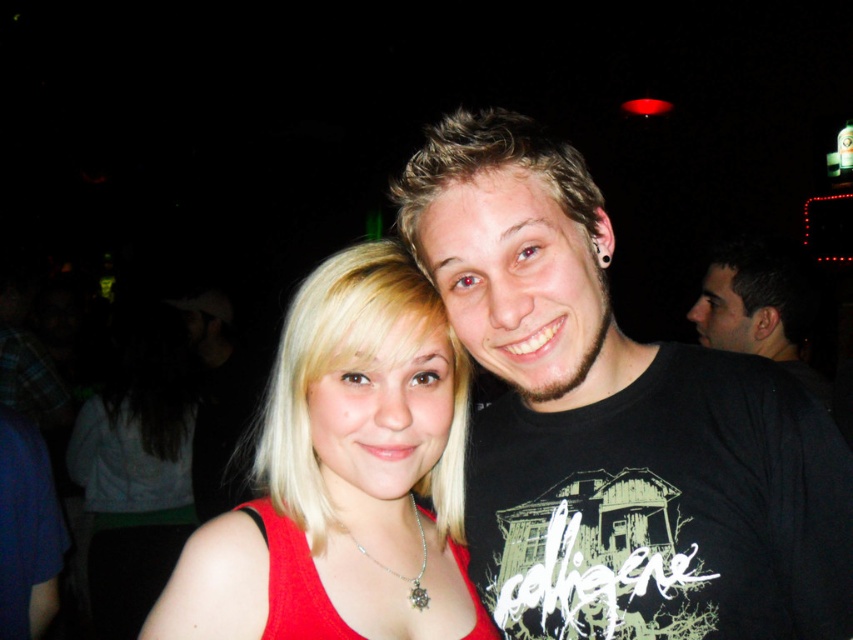
You are a photographer trying to focus on the person wearing the matte red tank top at center and the red fabric dress at center in the image. Which of these two red garments is positioned closer to the camera?

The matte red tank top at center is closer to the viewer than the red fabric dress at center, so the photographer should focus on the matte red tank top at center first as it is nearer to the camera.